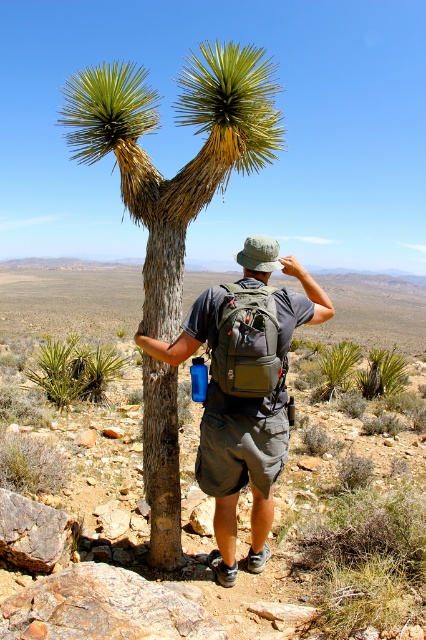
You are a desert explorer who needs to mark the location of a rare spiky plant in your map. You see a point marked at coordinates (x=186, y=163). According to the image, which object is this point located on?

The point marked at coordinates (x=186, y=163) is located on the green yellow spiky plant at center.